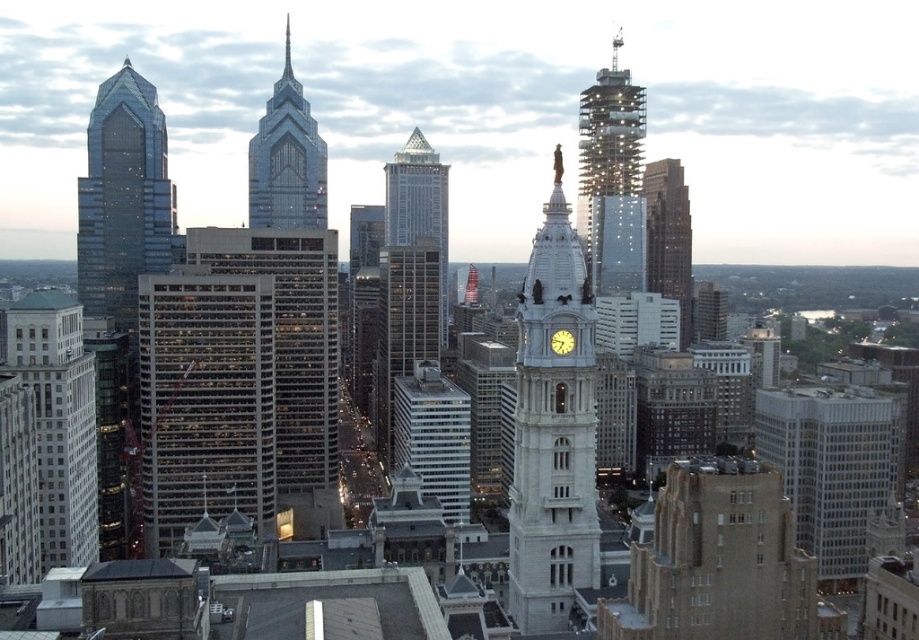
You are standing in front of the city skyline and want to take a photo of the white marble building at left. If you are currently 295.99 meters away from it, can you capture the entire building in one frame without moving closer?

The white marble building at left is exactly 295.99 meters from the viewer. Whether you can capture the entire building in one frame depends on your camera lens. A standard lens might require moving closer, but a wide angle lens could potentially capture the entire structure from this distance.

You are standing at the center of the city square and see the white marble building at left. If you want to take a photo of it, which direction should you face?

The white marble building at left is located at point (58, 420), which is to the left side of the scene. Therefore, you should face to the left to capture it in your photo.

You are an urban planner assessing the city skyline. You need to determine which of the two skyscrapers, the shiny glass skyscraper at left or the glassy steel skyscraper at center, would cast a longer shadow during the late afternoon. Based on their sizes, which one would you expect to cast a longer shadow?

The shiny glass skyscraper at left is larger in size compared to the glassy steel skyscraper at center, so it would cast a longer shadow during the late afternoon.